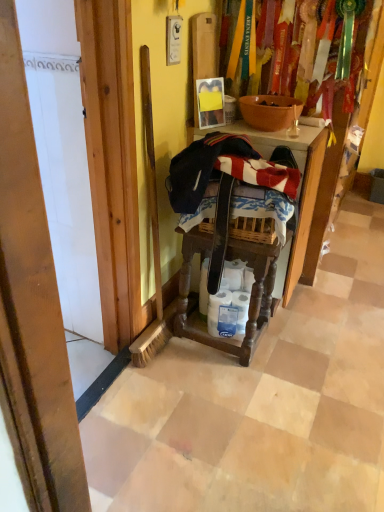
Question: Can you confirm if matte orange bowl at center is taller than white matte toilet paper at center?

Choices:
 (A) yes
 (B) no

Answer: (B)

Question: Does matte orange bowl at center come behind white matte toilet paper at center?

Choices:
 (A) yes
 (B) no

Answer: (B)

Question: From a real-world perspective, does matte orange bowl at center stand above white matte toilet paper at center?

Choices:
 (A) no
 (B) yes

Answer: (B)

Question: Does matte orange bowl at center appear on the right side of white matte toilet paper at center?

Choices:
 (A) no
 (B) yes

Answer: (B)

Question: Is white matte toilet paper at center located within matte orange bowl at center?

Choices:
 (A) yes
 (B) no

Answer: (B)

Question: Considering the positions of white matte toilet paper at center and matte orange bowl at center in the image, is white matte toilet paper at center bigger or smaller than matte orange bowl at center?

Choices:
 (A) small
 (B) big

Answer: (A)

Question: Does point (216, 297) appear closer or farther from the camera than point (261, 100)?

Choices:
 (A) closer
 (B) farther

Answer: (B)

Question: From the image's perspective, is white matte toilet paper at center above or below matte orange bowl at center?

Choices:
 (A) above
 (B) below

Answer: (B)

Question: In terms of height, does white matte toilet paper at center look taller or shorter compared to matte orange bowl at center?

Choices:
 (A) tall
 (B) short

Answer: (A)

Question: From the image's perspective, is wooden step stool at center above or below white matte toilet paper at center?

Choices:
 (A) above
 (B) below

Answer: (A)

Question: In the image, is wooden step stool at center positioned in front of or behind white matte toilet paper at center?

Choices:
 (A) behind
 (B) front

Answer: (B)

Question: Choose the correct answer: Is wooden step stool at center inside white matte toilet paper at center or outside it?

Choices:
 (A) inside
 (B) outside

Answer: (B)

Question: Considering the relative positions of wooden step stool at center and white matte toilet paper at center in the image provided, is wooden step stool at center to the left or to the right of white matte toilet paper at center?

Choices:
 (A) left
 (B) right

Answer: (A)

Question: From the image's perspective, is white matte toilet paper at center positioned above or below wooden step stool at center?

Choices:
 (A) above
 (B) below

Answer: (B)

Question: Looking at their shapes, would you say white matte toilet paper at center is wider or thinner than wooden step stool at center?

Choices:
 (A) thin
 (B) wide

Answer: (A)